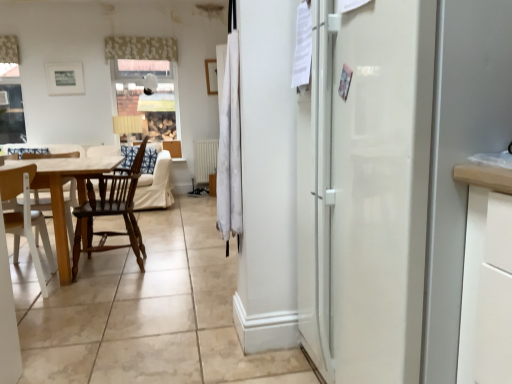
Question: Is white wood chair at lower left, the second chair viewed from the right, bigger or smaller than white floral fabric at upper center, the second curtain positioned from the right?

Choices:
 (A) small
 (B) big

Answer: (B)

Question: Considering the positions of white wood chair at lower left, the second chair viewed from the right, and white floral fabric at upper center, the second curtain positioned from the right, in the image, is white wood chair at lower left, the second chair viewed from the right, wider or thinner than white floral fabric at upper center, the second curtain positioned from the right,?

Choices:
 (A) wide
 (B) thin

Answer: (A)

Question: Which of these objects is positioned closest to the wooden table at left?

Choices:
 (A) white wood chair at lower left, positioned as the 1th chair in left-to-right order
 (B) white fabric curtain at center, placed as the first curtain when sorted from right to left
 (C) white matte radiator at center
 (D) dark brown wood chair at left, which ranks as the 2th chair in left-to-right order
 (E) white floral fabric at upper center, which is counted as the second curtain, starting from the bottom

Answer: (A)

Question: Which of these objects is positioned closest to the white floral fabric at upper center, the 1th curtain from the left?

Choices:
 (A) wooden table at left
 (B) white wood chair at lower left, positioned as the 1th chair in left-to-right order
 (C) dark brown wood chair at left, arranged as the 1th chair when viewed from the right
 (D) white matte radiator at center
 (E) white fabric curtain at center, the second curtain from the left

Answer: (D)